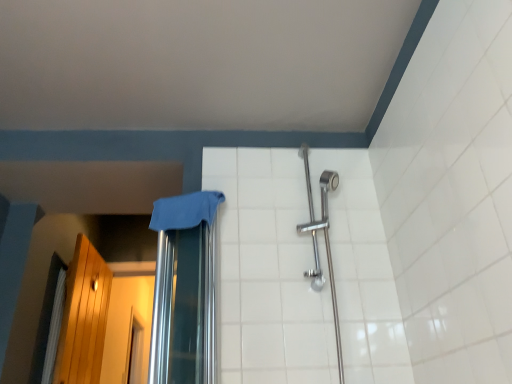
This screenshot has height=384, width=512. What do you see at coordinates (54, 328) in the screenshot?
I see `white fabric shower curtain at left` at bounding box center [54, 328].

What is the approximate height of white fabric shower curtain at left?

It is 64.94 centimeters.

Where is `white ceramic tile at center`? white ceramic tile at center is located at coordinates (269, 271).

Is wooden screen door at left wider or thinner than white ceramic tile at center?

Clearly, wooden screen door at left has more width compared to white ceramic tile at center.

Is wooden screen door at left directly adjacent to white ceramic tile at center?

No, wooden screen door at left is not with white ceramic tile at center.

Is wooden screen door at left oriented away from white ceramic tile at center?

No, wooden screen door at left is not facing the opposite direction of white ceramic tile at center.

Considering the positions of objects wooden screen door at left and white ceramic tile at center in the image provided, who is in front, wooden screen door at left or white ceramic tile at center?

white ceramic tile at center is closer to the camera.

Can white fabric shower curtain at left be found inside wooden screen door at left?

Yes, wooden screen door at left contains white fabric shower curtain at left.

From a real-world perspective, is wooden screen door at left positioned above or below white fabric shower curtain at left?

wooden screen door at left is above white fabric shower curtain at left.

In terms of width, does wooden screen door at left look wider or thinner when compared to white fabric shower curtain at left?

wooden screen door at left is wider than white fabric shower curtain at left.

Is point (81, 281) in front of point (59, 285)?

No, it is behind (59, 285).

The width and height of the screenshot is (512, 384). What are the coordinates of `shower curtain behind the blue fabric at center` in the screenshot? It's located at (54, 328).

Does point (153, 216) come behind point (54, 321)?

No, (153, 216) is in front of (54, 321).

In the scene shown: Measure the distance between blue fabric at center and white fabric shower curtain at left.

blue fabric at center and white fabric shower curtain at left are 3.74 feet apart from each other.

In the scene shown: From a real-world perspective, between blue fabric at center and white fabric shower curtain at left, who is vertically lower?

From a 3D spatial view, white fabric shower curtain at left is below.

Considering the sizes of objects blue fabric at center and wooden screen door at left in the image provided, who is wider, blue fabric at center or wooden screen door at left?

blue fabric at center is wider.

Is blue fabric at center bigger than wooden screen door at left?

Incorrect, blue fabric at center is not larger than wooden screen door at left.

Does blue fabric at center contain wooden screen door at left?

Actually, wooden screen door at left is outside blue fabric at center.

From the image's perspective, is blue fabric at center on top of wooden screen door at left?

Indeed, from the image's perspective, blue fabric at center is shown above wooden screen door at left.

From a real-world perspective, which is physically above, wooden screen door at left or blue fabric at center?

blue fabric at center is physically above.

Is point (81, 307) positioned behind point (183, 227)?

That is True.

Consider the image. What's the angular difference between wooden screen door at left and blue fabric at center's facing directions?

107 degrees separate the facing orientations of wooden screen door at left and blue fabric at center.

Between wooden screen door at left and blue fabric at center, which one has less height?

blue fabric at center is shorter.

From a real-world perspective, is white fabric shower curtain at left above or below blue fabric at center?

Clearly, from a real-world perspective, white fabric shower curtain at left is below blue fabric at center.

I want to click on cloth on the right side of white fabric shower curtain at left, so tap(185, 210).

Considering the positions of objects white fabric shower curtain at left and blue fabric at center in the image provided, who is in front, white fabric shower curtain at left or blue fabric at center?

blue fabric at center is in front.

From the image's perspective, between white fabric shower curtain at left and wooden screen door at left, who is located below?

From the image's view, wooden screen door at left is below.

Which is behind, point (52, 314) or point (62, 368)?

The point (52, 314) is behind.

Is white fabric shower curtain at left thinner than wooden screen door at left?

Correct, the width of white fabric shower curtain at left is less than that of wooden screen door at left.

Can you confirm if white fabric shower curtain at left is positioned to the right of wooden screen door at left?

No.

Identify the location of ceramic tile below the wooden screen door at left (from a real-world perspective). Image resolution: width=512 pixels, height=384 pixels. (269, 271).

The height and width of the screenshot is (384, 512). In the image, there is a wooden screen door at left. What are the coordinates of `shower curtain above it (from the image's perspective)` in the screenshot? It's located at (54, 328).

Which object lies nearer to the anchor point blue fabric at center, white fabric shower curtain at left or white ceramic tile at center?

white ceramic tile at center is positioned closer to the anchor blue fabric at center.

Based on their spatial positions, is white fabric shower curtain at left or wooden screen door at left further from white ceramic tile at center?

wooden screen door at left is positioned further to the anchor white ceramic tile at center.

From the image, which object appears to be nearer to wooden screen door at left, blue fabric at center or white fabric shower curtain at left?

Among the two, white fabric shower curtain at left is located nearer to wooden screen door at left.

Looking at the image, which one is located further to white fabric shower curtain at left, white ceramic tile at center or blue fabric at center?

white ceramic tile at center is positioned further to the anchor white fabric shower curtain at left.

Estimate the real-world distances between objects in this image. Which object is further from wooden screen door at left, white ceramic tile at center or blue fabric at center?

Based on the image, white ceramic tile at center appears to be further to wooden screen door at left.

From the image, which object appears to be nearer to white fabric shower curtain at left, blue fabric at center or white ceramic tile at center?

Among the two, blue fabric at center is located nearer to white fabric shower curtain at left.

Considering their positions, is wooden screen door at left positioned closer to blue fabric at center than white fabric shower curtain at left?

white fabric shower curtain at left lies closer to blue fabric at center than the other object.

Considering their positions, is blue fabric at center positioned further to white ceramic tile at center than wooden screen door at left?

Based on the image, wooden screen door at left appears to be further to white ceramic tile at center.

Image resolution: width=512 pixels, height=384 pixels. I want to click on screen door between white fabric shower curtain at left and white ceramic tile at center, so click(x=83, y=317).

Find the location of a particular element. This screenshot has height=384, width=512. cloth located between wooden screen door at left and white ceramic tile at center in the left-right direction is located at coordinates (185, 210).

The width and height of the screenshot is (512, 384). What are the coordinates of `cloth between white fabric shower curtain at left and white ceramic tile at center in the horizontal direction` in the screenshot? It's located at (185, 210).

Locate an element on the screen. The width and height of the screenshot is (512, 384). screen door between white fabric shower curtain at left and blue fabric at center in the horizontal direction is located at coordinates (83, 317).